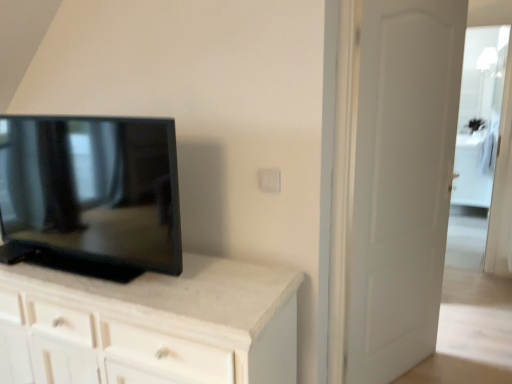
Question: Considering their positions, is transparent glass door at right located in front of or behind white matte door at right?

Choices:
 (A) behind
 (B) front

Answer: (A)

Question: From the image's perspective, is transparent glass door at right positioned above or below white matte door at right?

Choices:
 (A) above
 (B) below

Answer: (A)

Question: Which object is the farthest from the white matte door at right?

Choices:
 (A) transparent glass door at right
 (B) matte black tv at left

Answer: (A)

Question: Which of these objects is positioned closest to the white matte door at right?

Choices:
 (A) transparent glass door at right
 (B) matte black tv at left

Answer: (B)